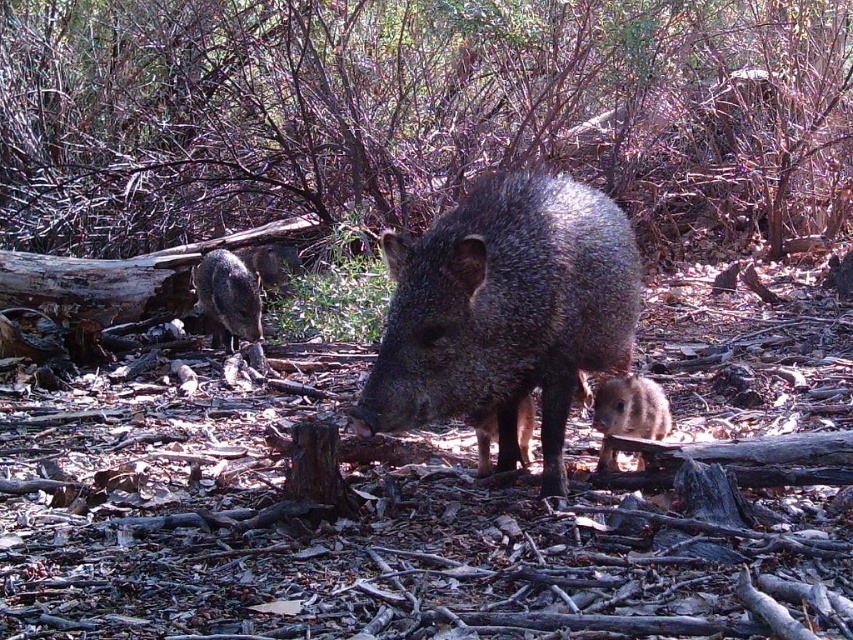
You are a wildlife photographer aiming to capture a photo of both the gray speckled piglet at center and the gray speckled piglet at lower left. Since you want to include both in the frame, which piglet is closer to the left side of the image?

The gray speckled piglet at lower left is closer to the left side of the image because the gray speckled piglet at center is positioned to its right.

You are a wildlife photographer trying to capture a photo of the gray speckled piglet at center and the gray speckled piglet at lower left. Based on their positions, which piglet is closer to the camera?

The gray speckled piglet at center is closer to the camera because it is in front of the gray speckled piglet at lower left.

Consider the image. You are a wildlife photographer aiming to capture a photo of both the gray speckled piglet at center and the gray speckled piglet at lower left. Based on their sizes, which piglet will appear larger in your photo?

The gray speckled piglet at center will appear larger in the photo because it is much taller than the gray speckled piglet at lower left.